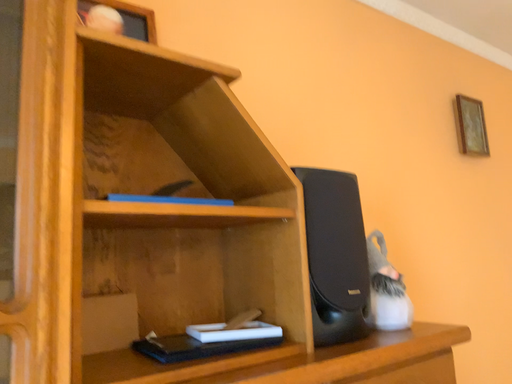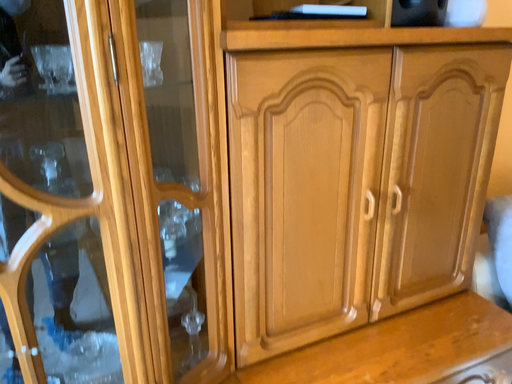
Question: Which way did the camera rotate in the video?

Choices:
 (A) rotated upward
 (B) rotated downward

Answer: (B)